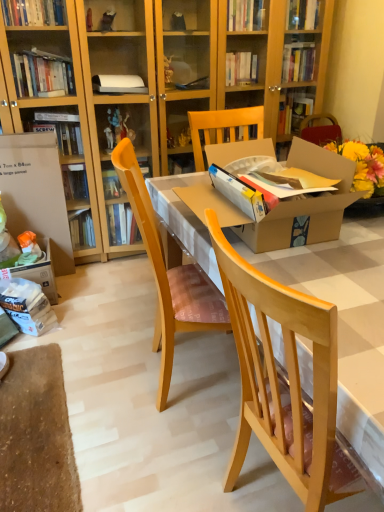
Locate an element on the screen. natural wood chair at center, arranged as the first chair when viewed from the right is located at coordinates (282, 380).

In the image, is wooden chair at center, the first chair in the left-to-right sequence, on the left side or the right side of cardboard box at left?

From the image, it's evident that wooden chair at center, the first chair in the left-to-right sequence, is to the right of cardboard box at left.

Is wooden chair at center, which ranks as the 2th chair in right-to-left order, positioned with its back to cardboard box at left?

No, wooden chair at center, which ranks as the 2th chair in right-to-left order,'s orientation is not away from cardboard box at left.

Which of these two, wooden chair at center, which ranks as the 2th chair in right-to-left order, or cardboard box at left, stands shorter?

With less height is cardboard box at left.

From the image's perspective, which object appears higher, wooden chair at center, the first chair in the left-to-right sequence, or cardboard box at left?

cardboard box at left is shown above in the image.

Is natural wood chair at center, arranged as the first chair when viewed from the right, behind cardboard box at left?

No, natural wood chair at center, arranged as the first chair when viewed from the right, is closer to the camera.

Which is correct: natural wood chair at center, arranged as the first chair when viewed from the right, is inside cardboard box at left, or outside of it?

natural wood chair at center, arranged as the first chair when viewed from the right, cannot be found inside cardboard box at left.

Looking at this image, can you see natural wood chair at center, the 2th chair from the left, touching cardboard box at left?

No, natural wood chair at center, the 2th chair from the left, is not making contact with cardboard box at left.

From the image's perspective, between natural wood chair at center, the 2th chair from the left, and cardboard box at left, who is located below?

natural wood chair at center, the 2th chair from the left, appears lower in the image.

Considering the relative sizes of natural wood chair at center, arranged as the first chair when viewed from the right, and wooden chair at center, which ranks as the 2th chair in right-to-left order, in the image provided, is natural wood chair at center, arranged as the first chair when viewed from the right, taller than wooden chair at center, which ranks as the 2th chair in right-to-left order,?

Yes, natural wood chair at center, arranged as the first chair when viewed from the right, is taller than wooden chair at center, which ranks as the 2th chair in right-to-left order.

Considering the sizes of objects natural wood chair at center, the 2th chair from the left, and wooden chair at center, the first chair in the left-to-right sequence, in the image provided, who is wider, natural wood chair at center, the 2th chair from the left, or wooden chair at center, the first chair in the left-to-right sequence,?

With larger width is natural wood chair at center, the 2th chair from the left.

From the picture: Do you think natural wood chair at center, the 2th chair from the left, is within wooden chair at center, which ranks as the 2th chair in right-to-left order, or outside of it?

The correct answer is: outside.

Considering the positions of point (63, 216) and point (133, 179), is point (63, 216) closer or farther from the camera than point (133, 179)?

Point (63, 216) is farther from the camera than point (133, 179).

Is wooden chair at center, the first chair in the left-to-right sequence, a part of cardboard box at left?

No, wooden chair at center, the first chair in the left-to-right sequence, is not surrounded by cardboard box at left.

Can you confirm if cardboard box at left is thinner than wooden chair at center, which ranks as the 2th chair in right-to-left order?

Indeed, cardboard box at left has a lesser width compared to wooden chair at center, which ranks as the 2th chair in right-to-left order.

Is cardboard box at left aimed at wooden chair at center, which ranks as the 2th chair in right-to-left order?

No, cardboard box at left is not aimed at wooden chair at center, which ranks as the 2th chair in right-to-left order.

Is cardboard box at left surrounding natural wood chair at center, arranged as the first chair when viewed from the right?

No, natural wood chair at center, arranged as the first chair when viewed from the right, is not inside cardboard box at left.

Between cardboard box at left and natural wood chair at center, arranged as the first chair when viewed from the right, which one appears on the left side from the viewer's perspective?

cardboard box at left is more to the left.

Between cardboard box at left and natural wood chair at center, arranged as the first chair when viewed from the right, which one has smaller width?

cardboard box at left.

Can you tell me how much cardboard box at left and natural wood chair at center, arranged as the first chair when viewed from the right, differ in facing direction?

The angular difference between cardboard box at left and natural wood chair at center, arranged as the first chair when viewed from the right, is 89.8 degrees.

How different are the orientations of wooden chair at center, which ranks as the 2th chair in right-to-left order, and natural wood chair at center, the 2th chair from the left, in degrees?

They differ by 14.1 degrees in their facing directions.

Does point (203, 293) appear closer or farther from the camera than point (311, 481)?

Point (203, 293) is positioned farther from the camera compared to point (311, 481).

In the scene shown: Does wooden chair at center, which ranks as the 2th chair in right-to-left order, lie behind natural wood chair at center, the 2th chair from the left?

Yes, it is behind natural wood chair at center, the 2th chair from the left.

Is wooden chair at center, which ranks as the 2th chair in right-to-left order, looking in the opposite direction of natural wood chair at center, the 2th chair from the left?

No, wooden chair at center, which ranks as the 2th chair in right-to-left order, is not facing the opposite direction of natural wood chair at center, the 2th chair from the left.

Image resolution: width=384 pixels, height=512 pixels. What are the coordinates of `box behind the wooden chair at center, the first chair in the left-to-right sequence` in the screenshot? It's located at (36, 193).

Identify the location of the 2nd chair in front of the cardboard box at left, starting your count from the anchor. (282, 380).

Looking at the image, which one is located further to wooden chair at center, the first chair in the left-to-right sequence, cardboard box at left or natural wood chair at center, the 2th chair from the left?

cardboard box at left is further to wooden chair at center, the first chair in the left-to-right sequence.

Based on their spatial positions, is natural wood chair at center, the 2th chair from the left, or wooden chair at center, the first chair in the left-to-right sequence, further from cardboard box at left?

natural wood chair at center, the 2th chair from the left, is further to cardboard box at left.

Which object lies nearer to the anchor point natural wood chair at center, arranged as the first chair when viewed from the right, cardboard box at left or wooden chair at center, which ranks as the 2th chair in right-to-left order?

Based on the image, wooden chair at center, which ranks as the 2th chair in right-to-left order, appears to be nearer to natural wood chair at center, arranged as the first chair when viewed from the right.

When comparing their distances from wooden chair at center, the first chair in the left-to-right sequence, does natural wood chair at center, arranged as the first chair when viewed from the right, or cardboard box at left seem closer?

The object closer to wooden chair at center, the first chair in the left-to-right sequence, is natural wood chair at center, arranged as the first chair when viewed from the right.

Looking at the image, which one is located further to cardboard box at left, wooden chair at center, the first chair in the left-to-right sequence, or natural wood chair at center, arranged as the first chair when viewed from the right?

The object further to cardboard box at left is natural wood chair at center, arranged as the first chair when viewed from the right.

Based on the photo, considering their positions, is wooden chair at center, the first chair in the left-to-right sequence, positioned further to natural wood chair at center, arranged as the first chair when viewed from the right, than cardboard box at left?

cardboard box at left.

At what (x,y) coordinates should I click in order to perform the action: click on chair between natural wood chair at center, arranged as the first chair when viewed from the right, and cardboard box at left from front to back. Please return your answer as a coordinate pair (x, y). Looking at the image, I should click on (168, 276).